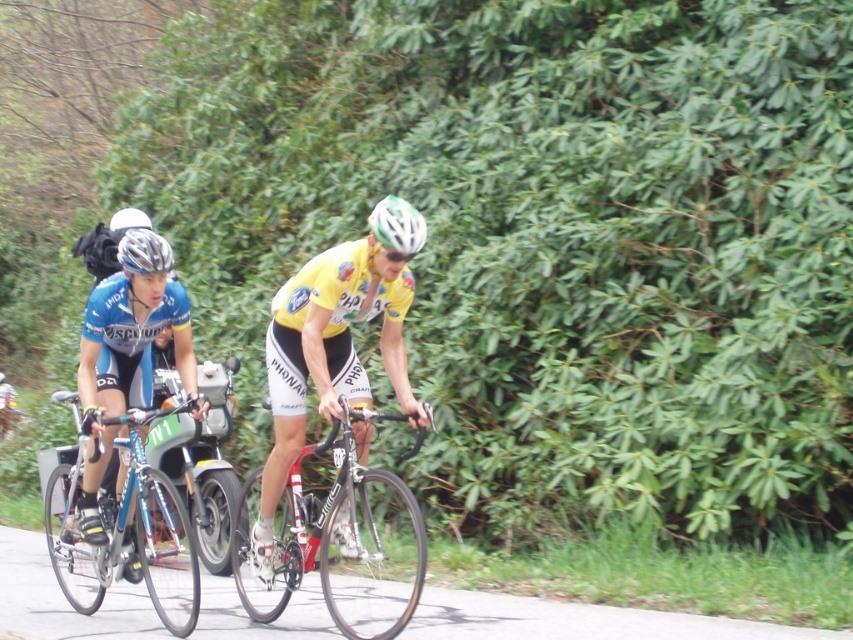
You are a photographer trying to capture both the shiny blue frame at center and the green matte bicycle helmet at center in a single shot. Based on their positions, which object should you focus on first to ensure both are in frame?

The shiny blue frame at center is located below the green matte bicycle helmet at center, so you should focus on the green matte bicycle helmet at center first to ensure both are in frame.